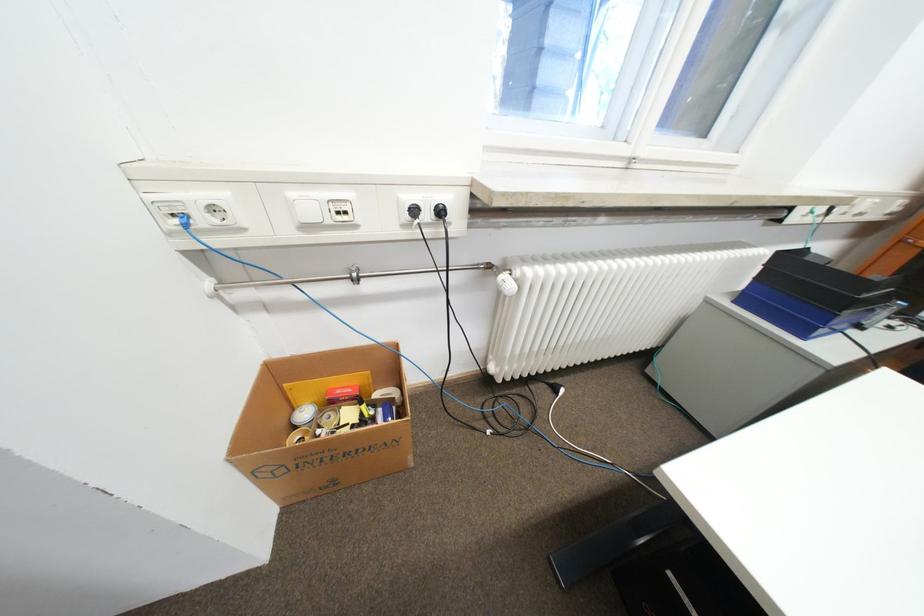
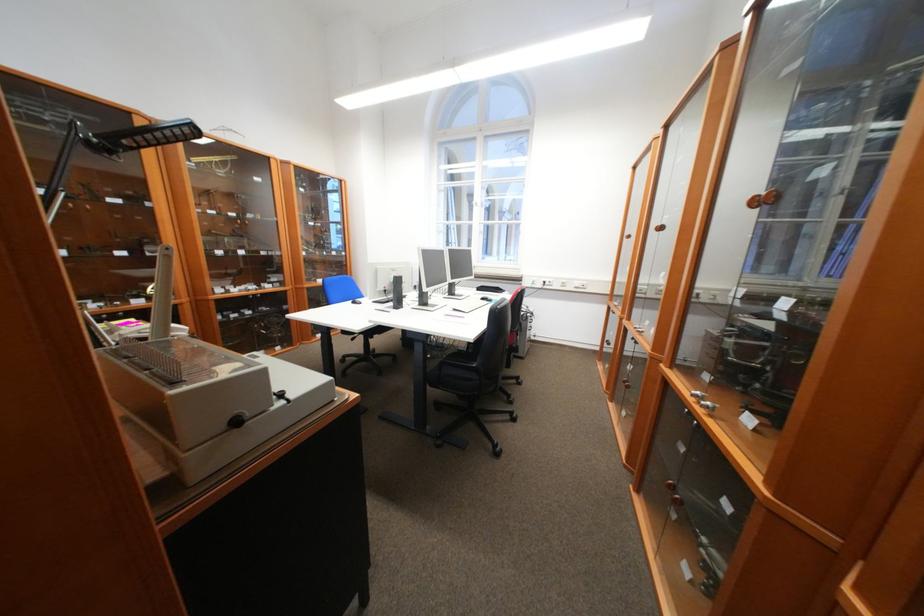
Question: I am providing you with two images of the same scene from different viewpoints. Please identify which objects are invisible in image2.

Choices:
 (A) black machine knob
 (B) dark-covered book
 (C) white power outlet
 (D) blue paper tray

Answer: (D)